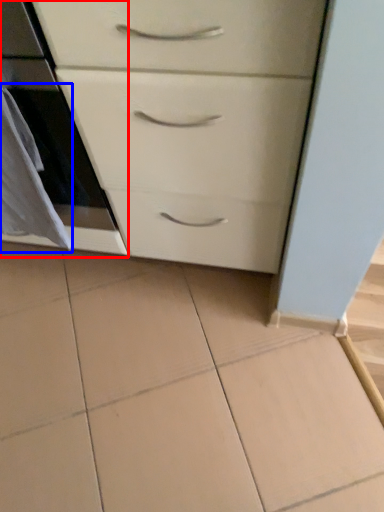
Question: Which point is closer to the camera, oven (highlighted by a red box) or material (highlighted by a blue box)?

Choices:
 (A) oven
 (B) material

Answer: (A)